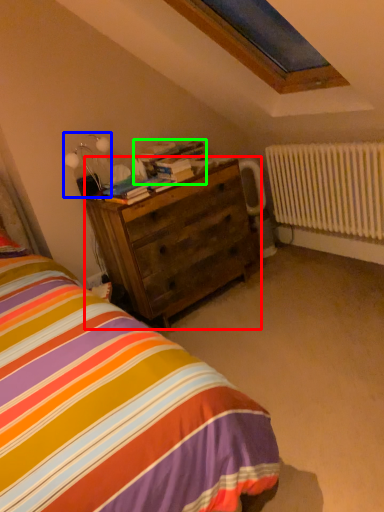
Question: Considering the real-world distances, which object is closest to chest of drawers (highlighted by a red box)? table lamp (highlighted by a blue box) or book (highlighted by a green box).

Choices:
 (A) table lamp
 (B) book

Answer: (B)